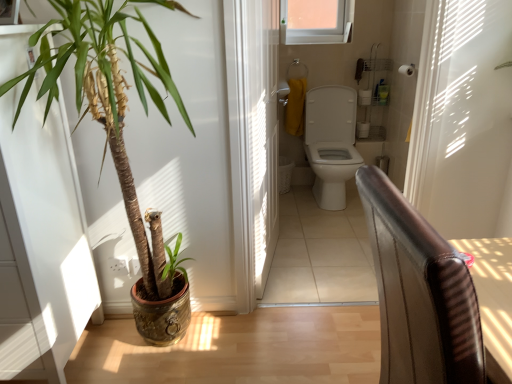
Question: Which is correct: wooden floor at lower left, the second path positioned from the top, is inside green leafy plant at left, or outside of it?

Choices:
 (A) outside
 (B) inside

Answer: (A)

Question: Is point (224, 360) positioned closer to the camera than point (147, 291)?

Choices:
 (A) farther
 (B) closer

Answer: (B)

Question: Estimate the real-world distances between objects in this image. Which object is farther from the white glossy toilet at center?

Choices:
 (A) wooden floor at lower left, which ranks as the second path in back-to-front order
 (B) translucent plastic screen door at center
 (C) green leafy plant at left
 (D) transparent glass window at upper center
 (E) white glossy toilet at center, the 1th path positioned from the top

Answer: (C)

Question: Considering the real-world distances, which object is closest to the transparent glass window at upper center?

Choices:
 (A) white glossy toilet at center, acting as the first path starting from the back
 (B) translucent plastic screen door at center
 (C) white plastic towel bar at upper center
 (D) white glossy toilet at center
 (E) green leafy plant at left

Answer: (D)